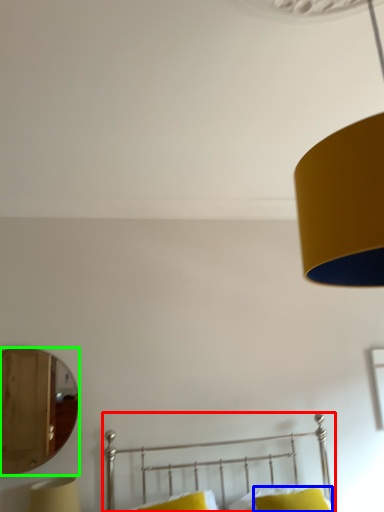
Question: Which is nearer to the bed (highlighted by a red box)? pillow (highlighted by a blue box) or mirror (highlighted by a green box).

Choices:
 (A) pillow
 (B) mirror

Answer: (A)